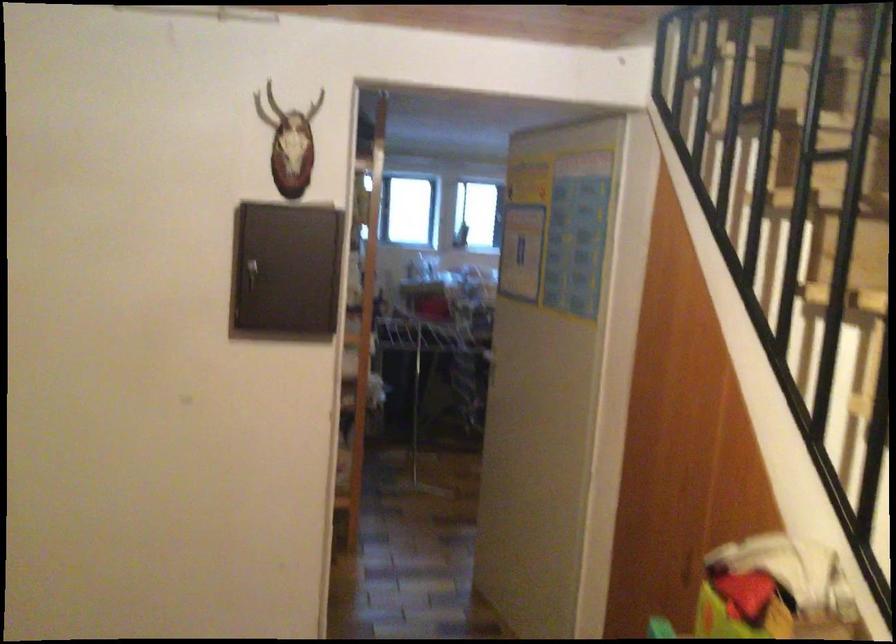
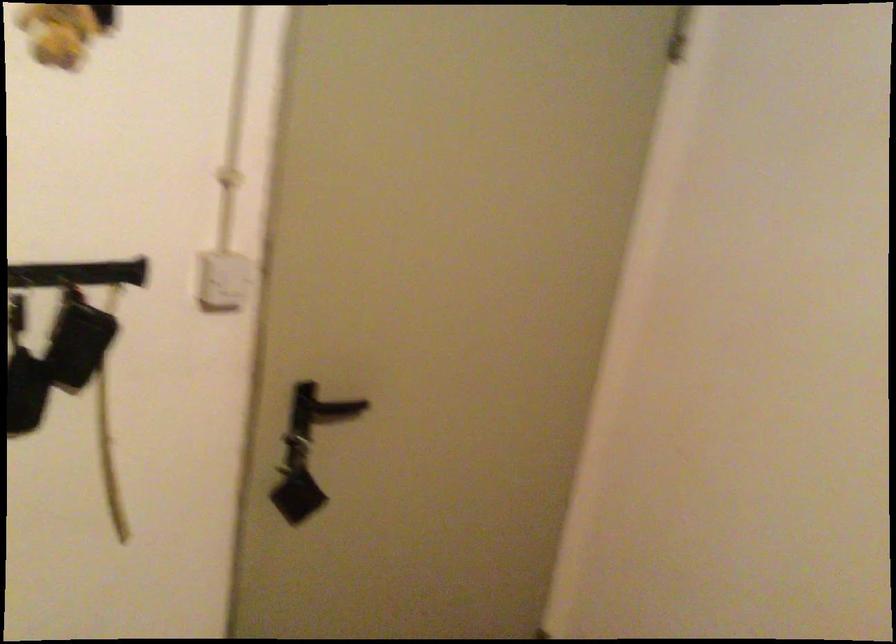
Question: The images are taken continuously from a first-person perspective. In which direction is your viewpoint rotating?

Choices:
 (A) Left
 (B) Right
 (C) Up
 (D) Down

Answer: (A)